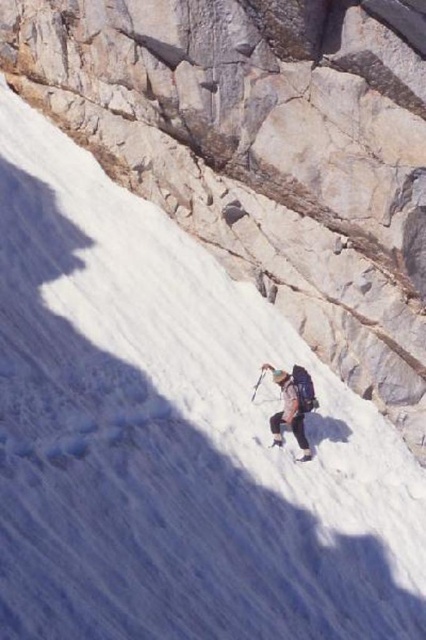
Who is shorter, camouflage fabric jacket at center or white matte ski at center?

white matte ski at center

Is camouflage fabric jacket at center above white matte ski at center?

Yes.

Does point (285, 372) lie behind point (276, 442)?

Yes.

The image size is (426, 640). I want to click on camouflage fabric jacket at center, so click(293, 404).

Is white matte ski at center bigger than white plastic ski pole at center?

No, white matte ski at center is not bigger than white plastic ski pole at center.

Which is in front, point (302, 458) or point (261, 381)?

Point (302, 458) is more forward.

The width and height of the screenshot is (426, 640). Identify the location of white matte ski at center. (304, 452).

Between camouflage fabric jacket at center and white plastic ski pole at center, which one has less height?

white plastic ski pole at center is shorter.

Is point (287, 424) closer to viewer compared to point (255, 385)?

Yes, point (287, 424) is in front of point (255, 385).

I want to click on camouflage fabric jacket at center, so click(x=293, y=404).

At what (x,y) coordinates should I click in order to perform the action: click on camouflage fabric jacket at center. Please return your answer as a coordinate pair (x, y). This screenshot has width=426, height=640. Looking at the image, I should click on (293, 404).